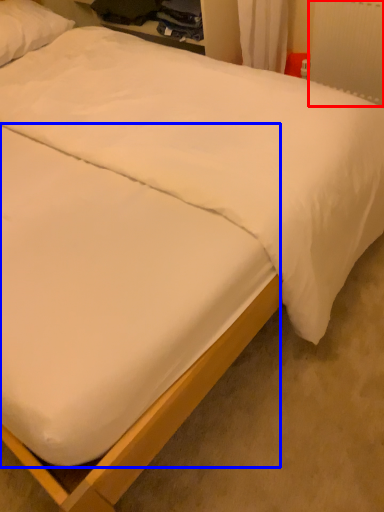
Question: Which of the following is the farthest to the observer, radiator (highlighted by a red box) or mattress (highlighted by a blue box)?

Choices:
 (A) radiator
 (B) mattress

Answer: (A)